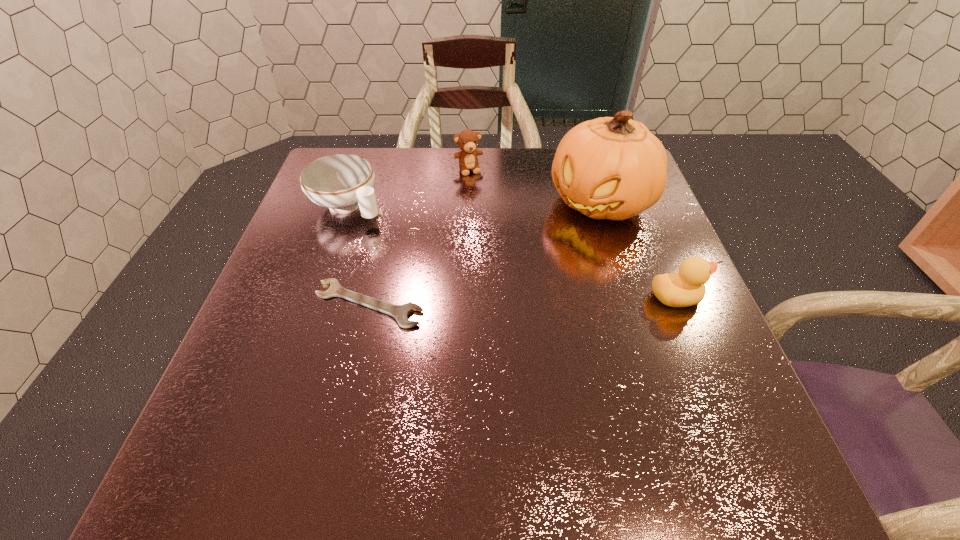
Identify the location of duckling present at the right edge. Image resolution: width=960 pixels, height=540 pixels. (686, 288).

The height and width of the screenshot is (540, 960). What are the coordinates of `pumpkin at the right edge` in the screenshot? It's located at (614, 168).

Where is `object located at the far left corner`? The height and width of the screenshot is (540, 960). object located at the far left corner is located at coordinates (342, 182).

This screenshot has height=540, width=960. I want to click on object that is at the far right corner, so click(x=614, y=168).

At what (x,y) coordinates should I click in order to perform the action: click on vacant area at the far edge of the desktop. Please return your answer as a coordinate pair (x, y). Looking at the image, I should click on (450, 191).

At what (x,y) coordinates should I click in order to perform the action: click on free location at the near edge. Please return your answer as a coordinate pair (x, y). This screenshot has width=960, height=540. Looking at the image, I should click on (433, 426).

You are a GUI agent. You are given a task and a screenshot of the screen. Output one action in this format:
    pyautogui.click(x=<x>, y=<y>)
    Task: Click on the vacant space at the left edge of the desktop
    The image size is (960, 540).
    Given the screenshot: What is the action you would take?
    pyautogui.click(x=310, y=363)

Image resolution: width=960 pixels, height=540 pixels. In the image, there is a desktop. In order to click on free space at the right edge in this screenshot , I will do `click(647, 295)`.

Identify the location of vacant space at the near right corner of the desktop. (662, 390).

This screenshot has height=540, width=960. I want to click on vacant point located between the shortest object and the chinaware, so click(358, 254).